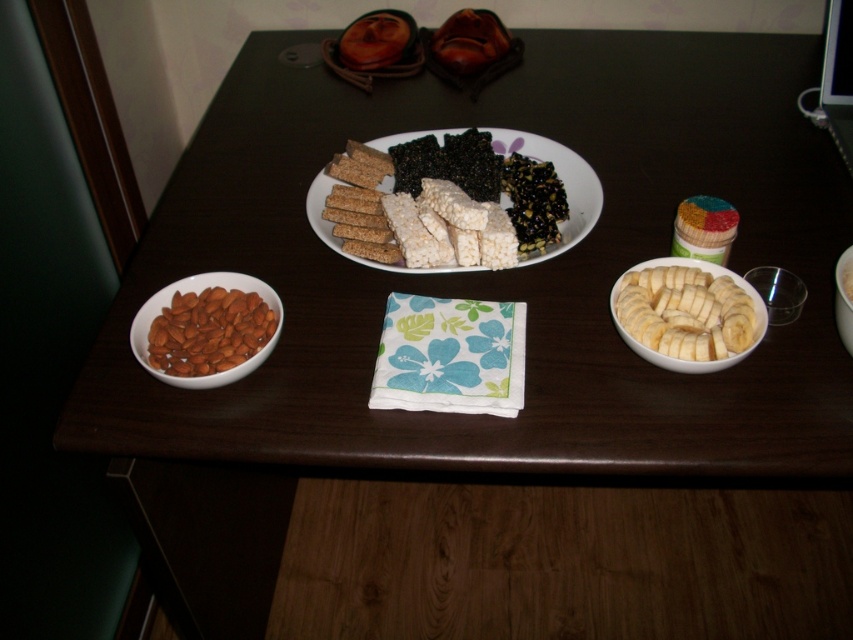
You are standing at the edge of the table looking towards the center. There are two points marked on the table. The first point is at coordinate point[219,339] and the second point is at coordinate point[589,214]. Which point is closer to you?

Point[219,339] is in front of point[589,214], so the first point is closer to you.

You are a guest at a party and want to choose a snack that is smaller in size between the smooth almond at left and the white rice cake at center. Which one should you pick?

The smooth almond at left is smaller than the white rice cake at center, so you should pick the smooth almond at left.

You are a guest at a dinner party and want to grab some sliced bananas at right. The host mentioned there is a point at coordinate (685, 312) on the table. Can you tell me where exactly is the point located in relation to the white smooth sliced bananas at right?

The point at coordinate (685, 312) marks the location of the white smooth sliced bananas at right.